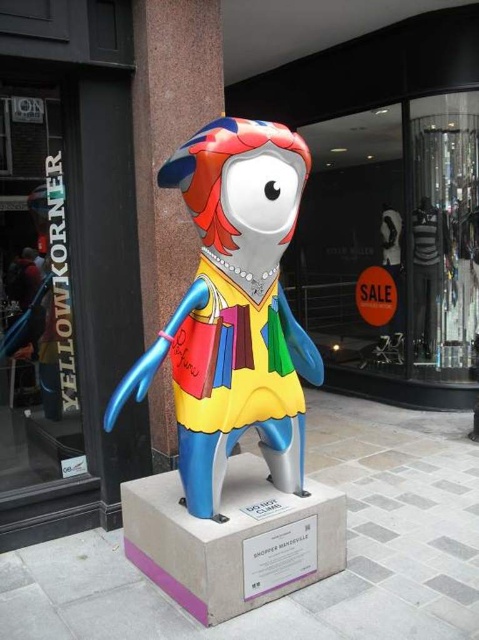
How far apart are transparent glass window at left and clear glass mannequins at center?

A distance of 3.57 meters exists between transparent glass window at left and clear glass mannequins at center.

From the picture: Can you confirm if transparent glass window at left is thinner than clear glass mannequins at center?

Yes, transparent glass window at left is thinner than clear glass mannequins at center.

Who is more distant from viewer, (22,364) or (456,266)?

The point (456,266) is more distant.

Find the location of a particular element. The width and height of the screenshot is (479, 640). transparent glass window at left is located at coordinates (41, 400).

Is metallic multicolored statue at center positioned in front of clear glass mannequins at center?

That is True.

Who is lower down, metallic multicolored statue at center or clear glass mannequins at center?

metallic multicolored statue at center is lower down.

Is point (238, 170) farther from camera compared to point (460, 132)?

No, it is in front of (460, 132).

The height and width of the screenshot is (640, 479). In order to click on metallic multicolored statue at center in this screenshot , I will do `click(234, 308)`.

Based on the photo, does glass display at center appear under transparent glass window at left?

No.

Between glass display at center and transparent glass window at left, which one has less height?

With less height is transparent glass window at left.

Does point (392, 296) lie behind point (49, 196)?

Yes.

The image size is (479, 640). Find the location of `glass display at center`. glass display at center is located at coordinates (391, 244).